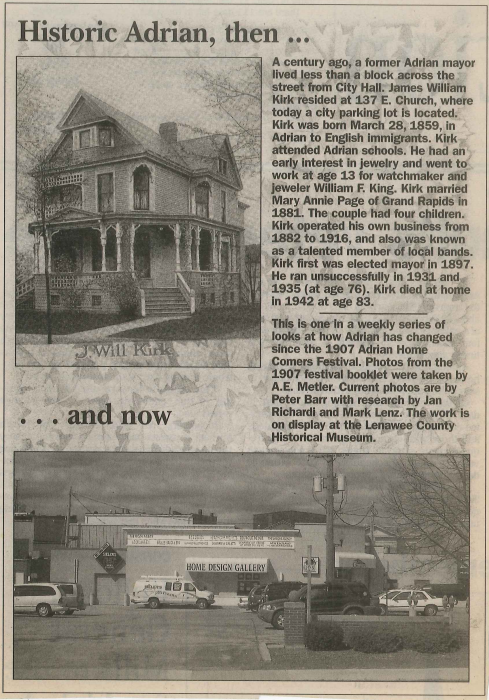
Find the location of a particular element. newspaper is located at coordinates (250, 423).